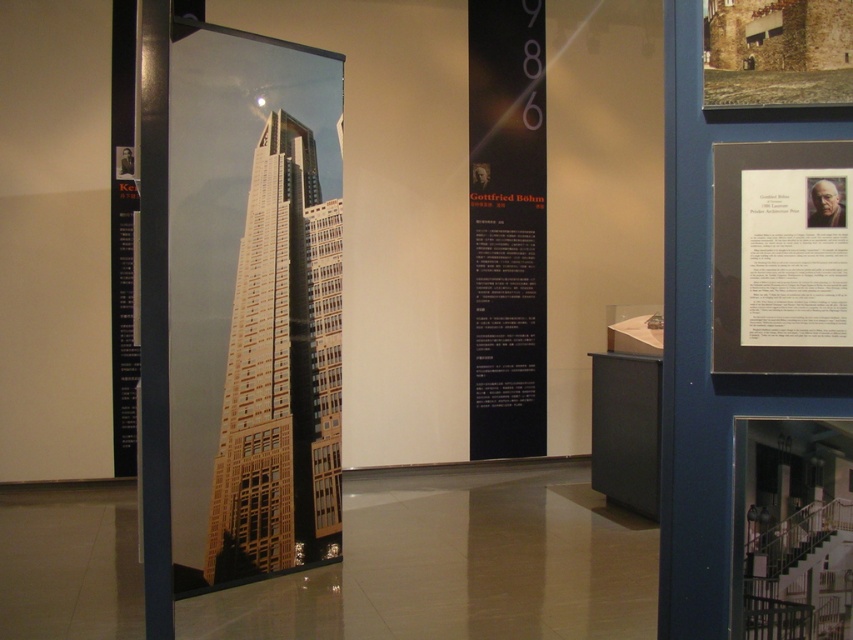
Can you confirm if black matte poster at center is positioned to the right of white paper at upper right?

In fact, black matte poster at center is to the left of white paper at upper right.

Consider the image. Is black matte poster at center shorter than white paper at upper right?

In fact, black matte poster at center may be taller than white paper at upper right.

This screenshot has width=853, height=640. In order to click on black matte poster at center in this screenshot , I will do [x=506, y=227].

Which is below, matte glass skyscraper at center or white paper at upper right?

matte glass skyscraper at center is below.

Identify the location of matte glass skyscraper at center. (253, 305).

Is matte glass skyscraper at center below black matte poster at center?

Correct, matte glass skyscraper at center is located below black matte poster at center.

Measure the distance between matte glass skyscraper at center and black matte poster at center.

matte glass skyscraper at center and black matte poster at center are 2.46 meters apart from each other.

Is point (253, 376) more distant than point (514, 317)?

No, (253, 376) is closer to viewer.

Where is `matte glass skyscraper at center`? The width and height of the screenshot is (853, 640). matte glass skyscraper at center is located at coordinates (253, 305).